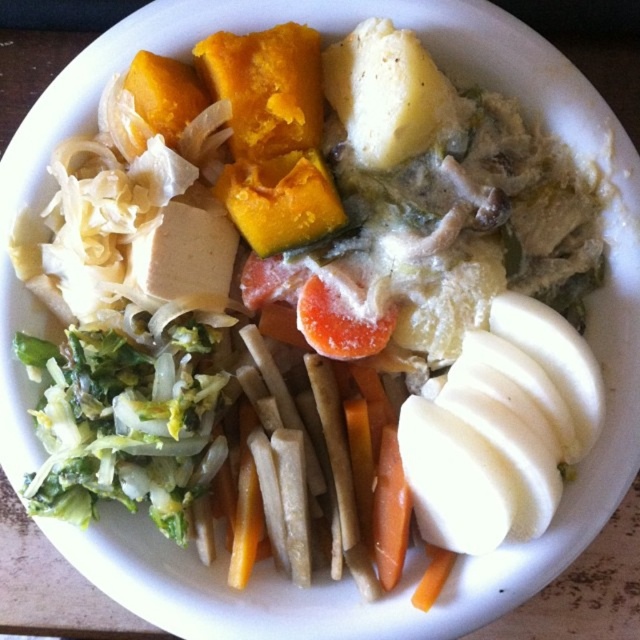
Question: Considering the real-world distances, which object is farthest from the yellow matte potato at upper center?

Choices:
 (A) green leafymaterial/texturevegetable at lower left
 (B) orange smooth carrot at center

Answer: (A)

Question: Does yellow matte potato at upper center have a larger size compared to orange smooth carrot at center?

Choices:
 (A) no
 (B) yes

Answer: (B)

Question: Does green leafymaterial/texturevegetable at lower left have a smaller size compared to yellow matte potato at upper center?

Choices:
 (A) yes
 (B) no

Answer: (B)

Question: Which point is farther from the camera taking this photo?

Choices:
 (A) (390, 483)
 (B) (145, 355)
 (C) (435, 125)

Answer: (A)

Question: Is green leafymaterial/texturevegetable at lower left above orange smooth carrot at center?

Choices:
 (A) no
 (B) yes

Answer: (B)

Question: Which of the following is the farthest from the observer?

Choices:
 (A) yellow matte potato at upper center
 (B) green leafymaterial/texturevegetable at lower left

Answer: (A)